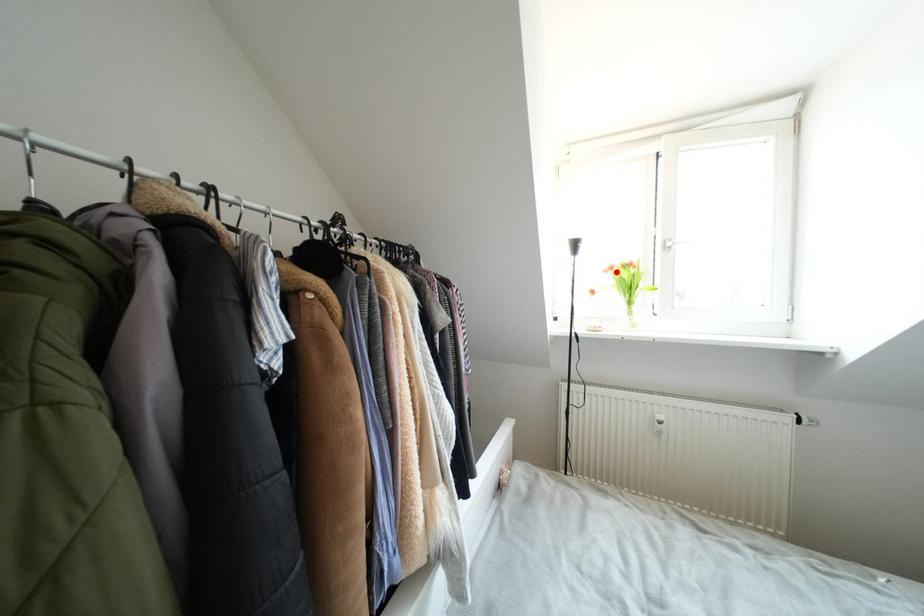
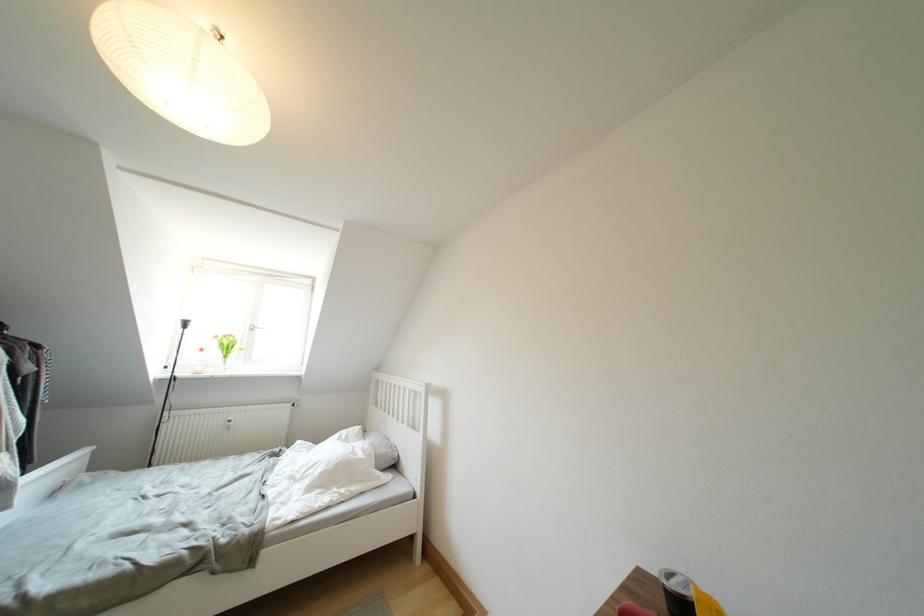
Where in the second image is the point corresponding to the highlighted location from the first image?

(222, 341)